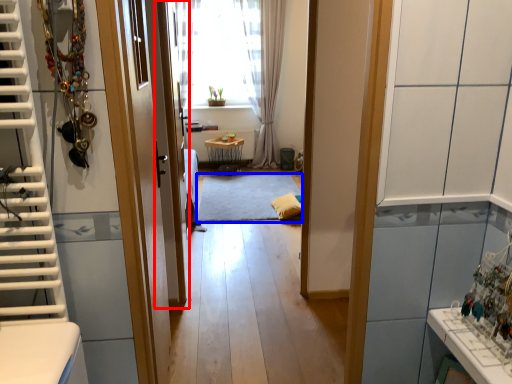
Question: Which object appears closest to the camera in this image, screen door (highlighted by a red box) or mat (highlighted by a blue box)?

Choices:
 (A) screen door
 (B) mat

Answer: (A)